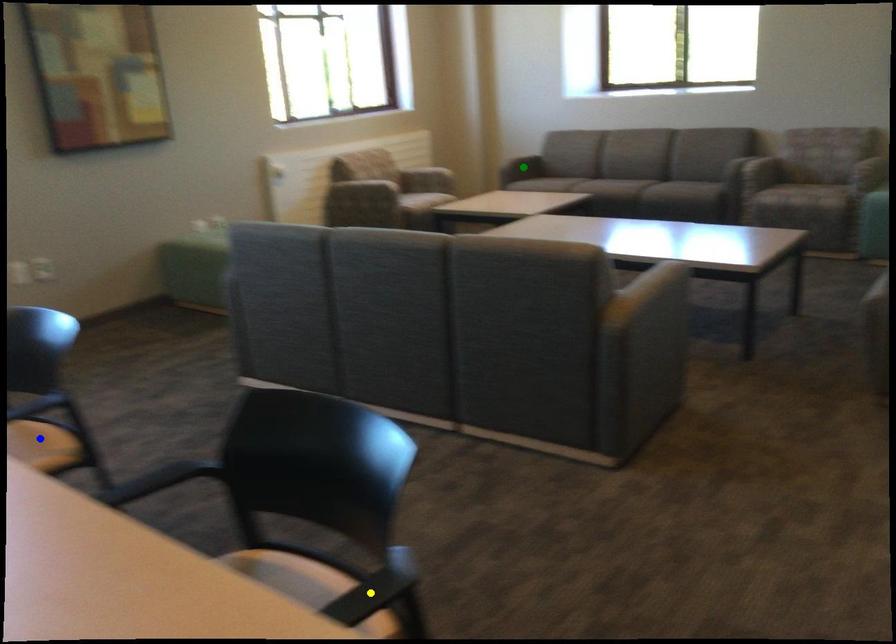
Based on the photo, order these from nearest to farthest:
green point
blue point
yellow point

yellow point → blue point → green point